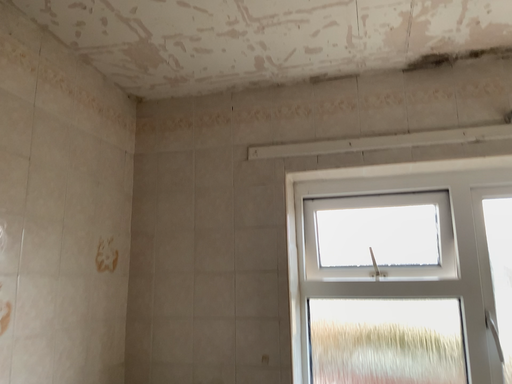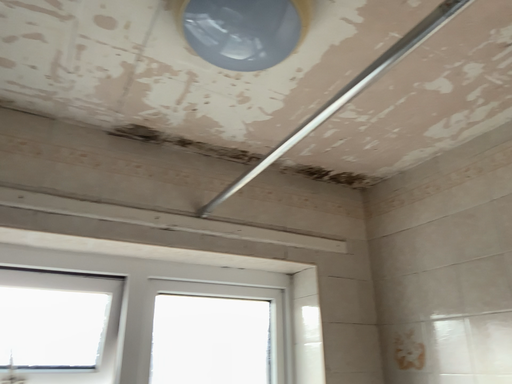
Question: Which way did the camera rotate in the video?

Choices:
 (A) rotated right
 (B) rotated left

Answer: (A)